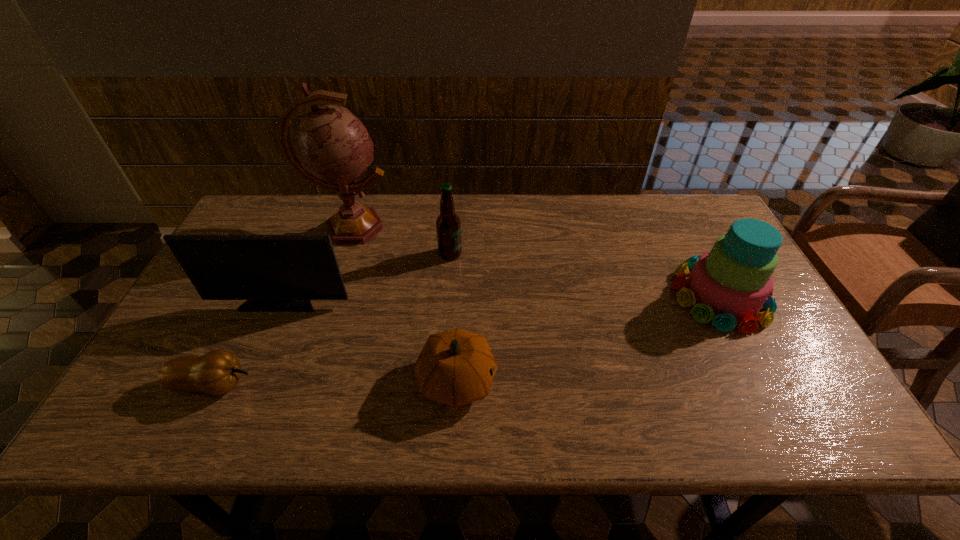
In the image, there is a desktop. Identify the location of vacant space at the near left corner. [x=171, y=404].

Where is `unoccupied position between the globe and the right gourd`? Image resolution: width=960 pixels, height=540 pixels. unoccupied position between the globe and the right gourd is located at coordinates (404, 304).

Locate an element on the screen. This screenshot has width=960, height=540. empty space between the shorter gourd and the monitor is located at coordinates (247, 343).

In order to click on free space between the rightmost object and the second shortest object in this screenshot , I will do `click(588, 338)`.

What are the coordinates of `free point between the rightmost object and the monitor` in the screenshot? It's located at (501, 298).

Image resolution: width=960 pixels, height=540 pixels. I want to click on vacant area that lies between the fifth tallest object and the shorter gourd, so click(335, 382).

Locate an element on the screen. This screenshot has height=540, width=960. free spot between the shortest object and the beer bottle is located at coordinates (331, 319).

I want to click on unoccupied area between the taller gourd and the monitor, so click(x=369, y=341).

You are a GUI agent. You are given a task and a screenshot of the screen. Output one action in this format:
    pyautogui.click(x=<x>, y=<y>)
    Task: Click on the empty space that is in between the beer bottle and the monitor
    
    Given the screenshot: What is the action you would take?
    pyautogui.click(x=366, y=278)

Identify the location of object that ranks as the closest to the beer bottle. (333, 149).